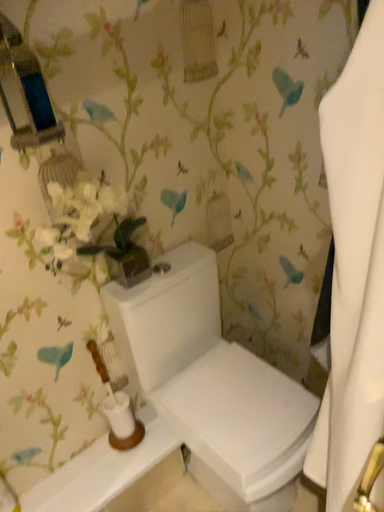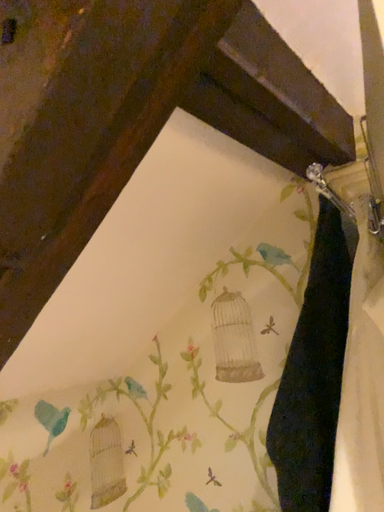
Question: Which way did the camera rotate in the video?

Choices:
 (A) rotated downward
 (B) rotated upward

Answer: (B)